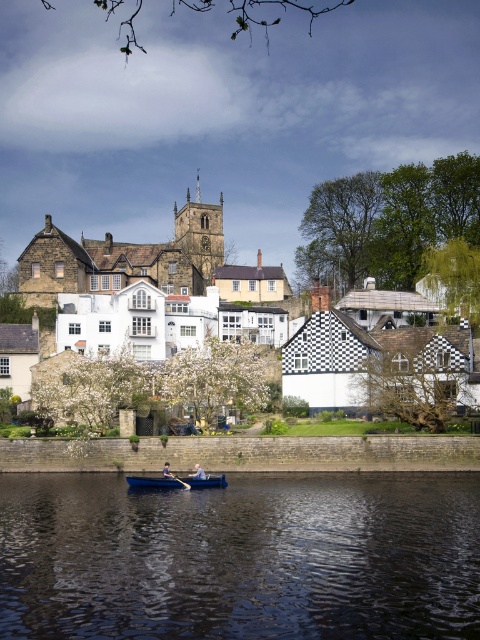
You are standing on the riverside and want to reach the wooden canoe at center. Which direction should you walk to get there?

To reach the wooden canoe at center, you should walk towards the center of the river since it is located at point (179, 481).

From the picture: You are standing on the riverside path and see the dark blue water at lower center and the wooden paddle at center. Which object is closer to you?

The dark blue water at lower center is closer to you because it is in front of the wooden paddle at center.